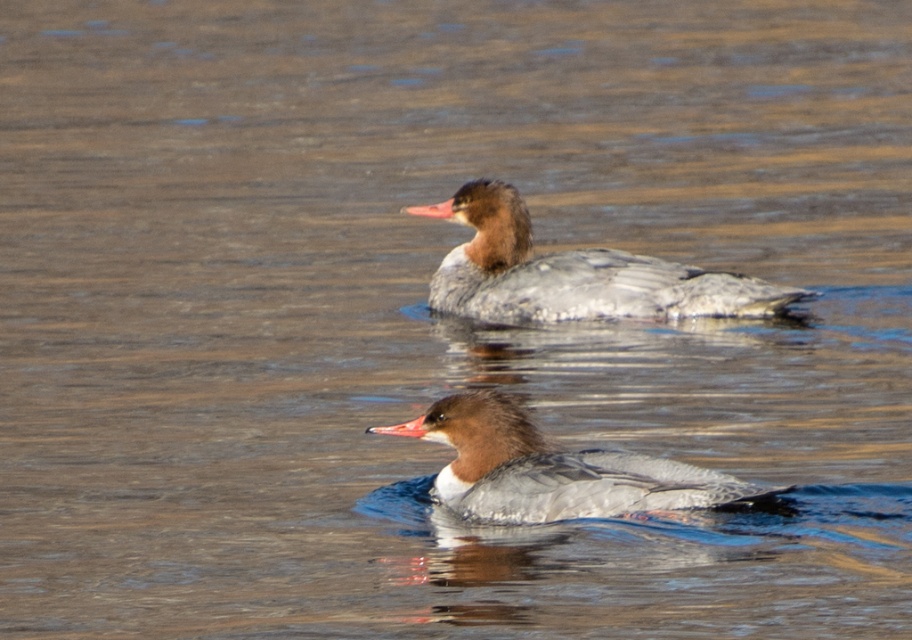
Question: Is brown speckled duck at center above brown-feathered duck at center?

Choices:
 (A) yes
 (B) no

Answer: (A)

Question: Which object appears closest to the camera in this image?

Choices:
 (A) brown speckled duck at center
 (B) brown-feathered duck at center

Answer: (B)

Question: Is brown speckled duck at center positioned in front of brown-feathered duck at center?

Choices:
 (A) yes
 (B) no

Answer: (B)

Question: Which object appears farthest from the camera in this image?

Choices:
 (A) brown-feathered duck at center
 (B) brown speckled duck at center

Answer: (B)

Question: Is brown speckled duck at center positioned before brown-feathered duck at center?

Choices:
 (A) yes
 (B) no

Answer: (B)